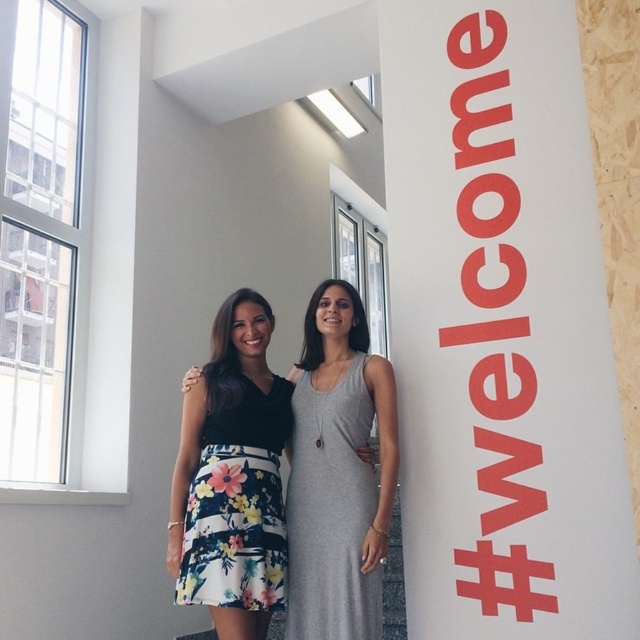
You are an interior designer assessing the space for a new sculpture. The sculpture requires a base that must be wider than the gray matte dress at center. Can the white smooth pillar at upper center accommodate this requirement?

The white smooth pillar at upper center has a width larger than the gray matte dress at center, so it can accommodate the sculpture base that needs to be wider than the dress.

You are a fashion designer observing two women in the scene. The first woman wears a floral print skirt at center, and the second wears a floral print fabric dress at center. Which of their floral patterns has a wider horizontal spread?

The floral print skirt at center has a wider horizontal spread than the floral print fabric dress at center, as its width is larger according to the description.